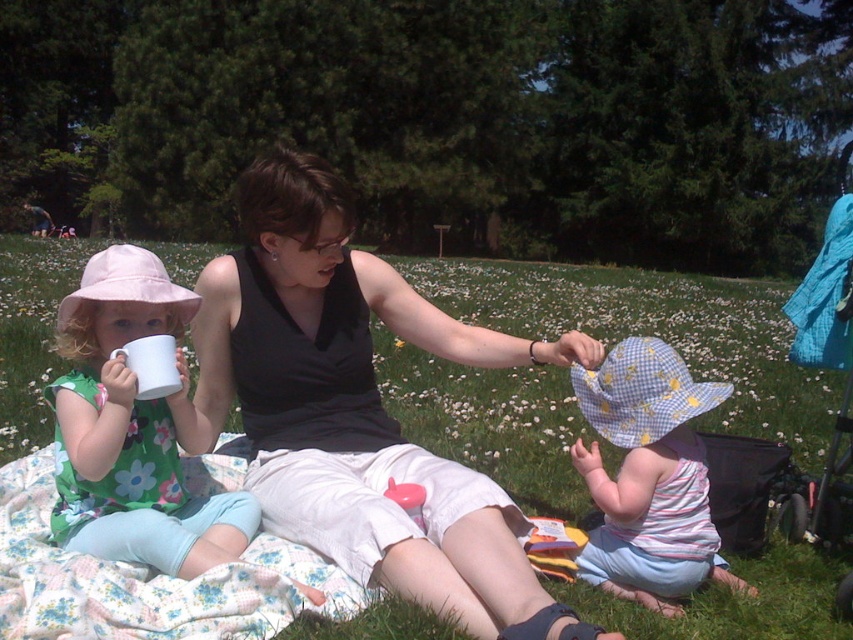
What is located at the point with coordinates [657,332] in the image?

The point with coordinates [657,332] marks green grass at center.

You are taking a photo of the picnic scene and want to focus on two specific points in the image. The first point is at coordinates point (573,420) and the second point is at coordinates point (607,410). Which point should you focus on first if you want to ensure both points are in focus?

You should focus on point (573,420) first because it is closer to the camera than point (607,410), ensuring both points will be in focus when focusing on the closer one.